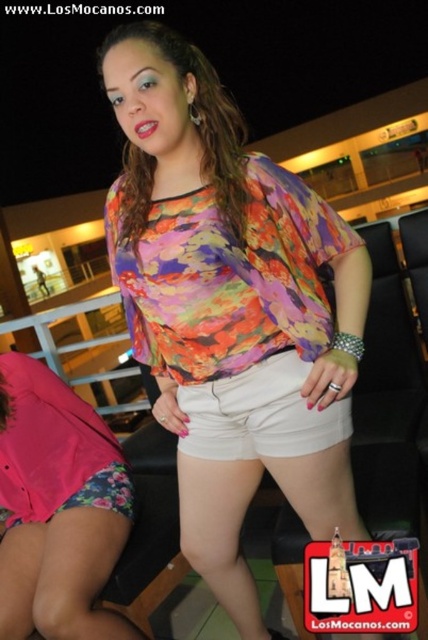
Question: Is floral print blouse at center to the right of multicolored fabric blouse at center from the viewer's perspective?

Choices:
 (A) no
 (B) yes

Answer: (B)

Question: Which of these objects is positioned closest to the pink floral shorts at lower left?

Choices:
 (A) floral print blouse at center
 (B) multicolored fabric blouse at center

Answer: (A)

Question: Is floral print blouse at center thinner than pink floral shorts at lower left?

Choices:
 (A) no
 (B) yes

Answer: (A)

Question: Which object is the farthest from the white cotton shorts at center?

Choices:
 (A) pink floral shorts at lower left
 (B) multicolored fabric blouse at center

Answer: (A)

Question: Which object is farther from the camera taking this photo?

Choices:
 (A) floral print blouse at center
 (B) pink floral shorts at lower left
 (C) multicolored fabric blouse at center
 (D) white cotton shorts at center

Answer: (B)

Question: Where is floral print blouse at center located in relation to multicolored fabric blouse at center in the image?

Choices:
 (A) above
 (B) below

Answer: (B)